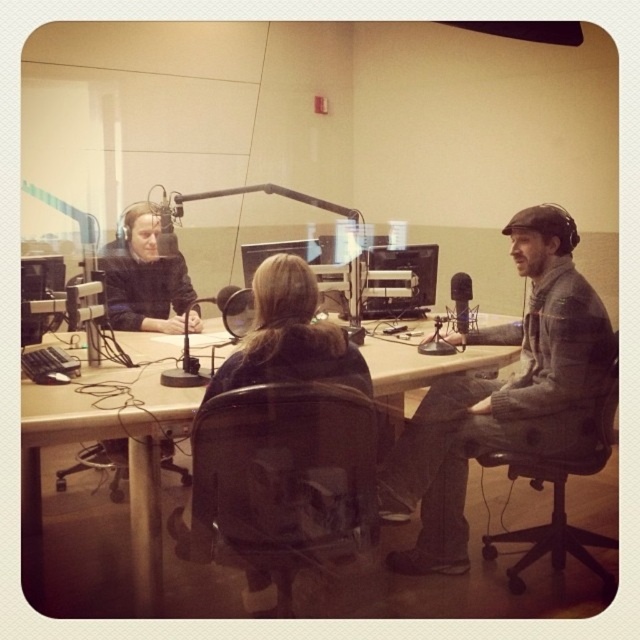
Does point (124, 429) lie in front of point (468, 314)?

Yes, it is in front of point (468, 314).

This screenshot has width=640, height=640. I want to click on wooden table at center, so click(x=104, y=438).

I want to click on wooden table at center, so click(104, 438).

Which is more to the left, textured gray jacket at right or matte black headphones at left?

Positioned to the left is matte black headphones at left.

Is textured gray jacket at right shorter than matte black headphones at left?

Incorrect, textured gray jacket at right's height does not fall short of matte black headphones at left's.

Is point (492, 433) in front of point (134, 268)?

Yes, point (492, 433) is closer to viewer.

Find the location of `textured gray jacket at right`. textured gray jacket at right is located at coordinates (502, 396).

Between point (24, 456) and point (156, 208), which one is positioned in front?

Positioned in front is point (24, 456).

Find the location of `wooden table at center`. wooden table at center is located at coordinates (104, 438).